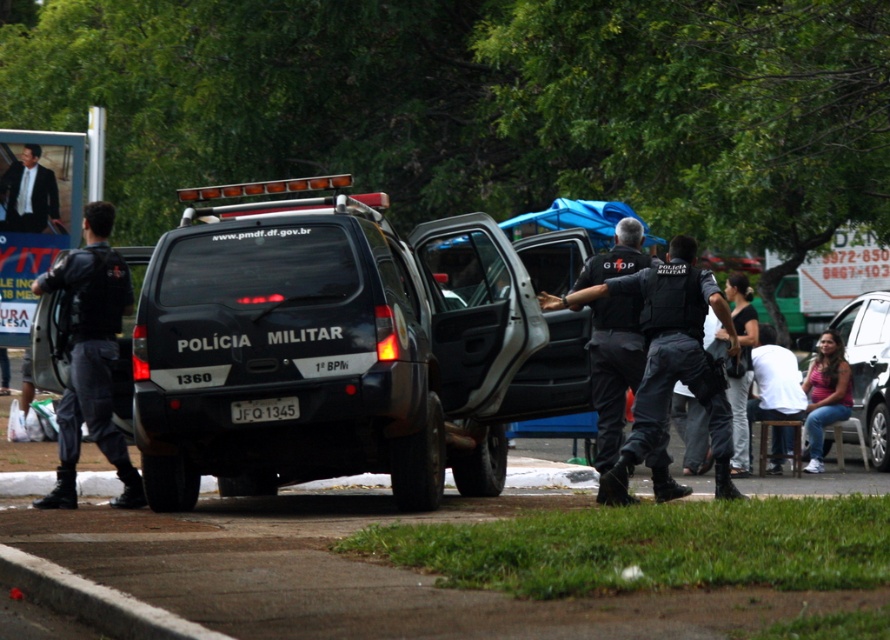
Who is positioned more to the left, matte black vehicle at center or black matte uniform at center?

matte black vehicle at center

Measure the distance from matte black vehicle at center to black matte uniform at center.

A distance of 1.25 meters exists between matte black vehicle at center and black matte uniform at center.

Identify the location of matte black vehicle at center. (326, 346).

Is black tactical vest at center further to the viewer compared to white matte car at lower right?

No.

Is black tactical vest at center in front of white matte car at lower right?

Yes, black tactical vest at center is in front of white matte car at lower right.

In the scene shown: Measure the distance between black tactical vest at center and camera.

12.29 meters

You are a GUI agent. You are given a task and a screenshot of the screen. Output one action in this format:
    pyautogui.click(x=<x>, y=<y>)
    Task: Click on the black tactical vest at center
    
    Given the screenshot: What is the action you would take?
    pyautogui.click(x=668, y=360)

Is white matte car at lower right to the left of pink fabric shirt at lower right from the viewer's perspective?

No, white matte car at lower right is not to the left of pink fabric shirt at lower right.

Who is positioned more to the right, white matte car at lower right or pink fabric shirt at lower right?

From the viewer's perspective, white matte car at lower right appears more on the right side.

Identify the location of white matte car at lower right. (868, 371).

Locate an element on the screen. Image resolution: width=890 pixels, height=640 pixels. white matte car at lower right is located at coordinates (868, 371).